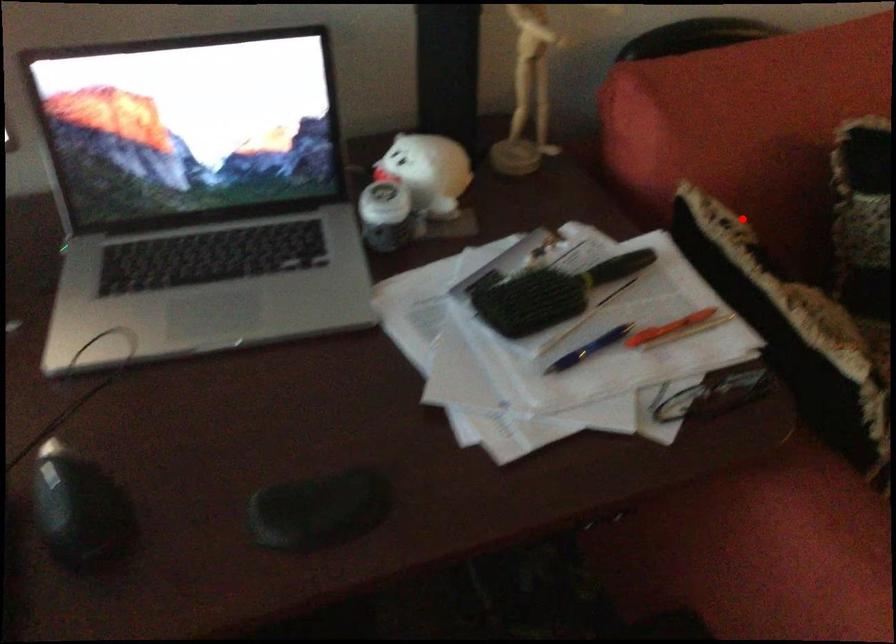
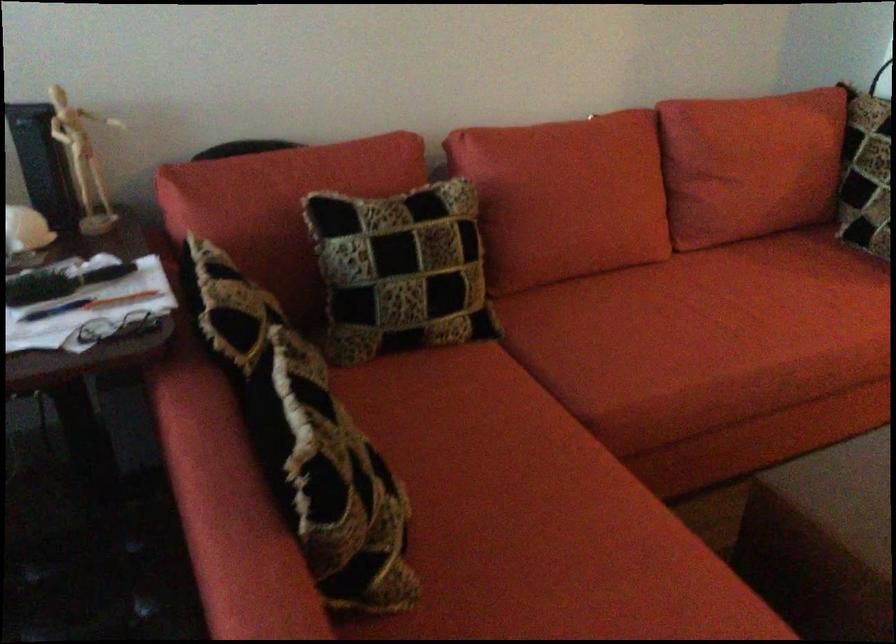
The point at the highlighted location is marked in the first image. Where is the corresponding point in the second image?

(261, 263)